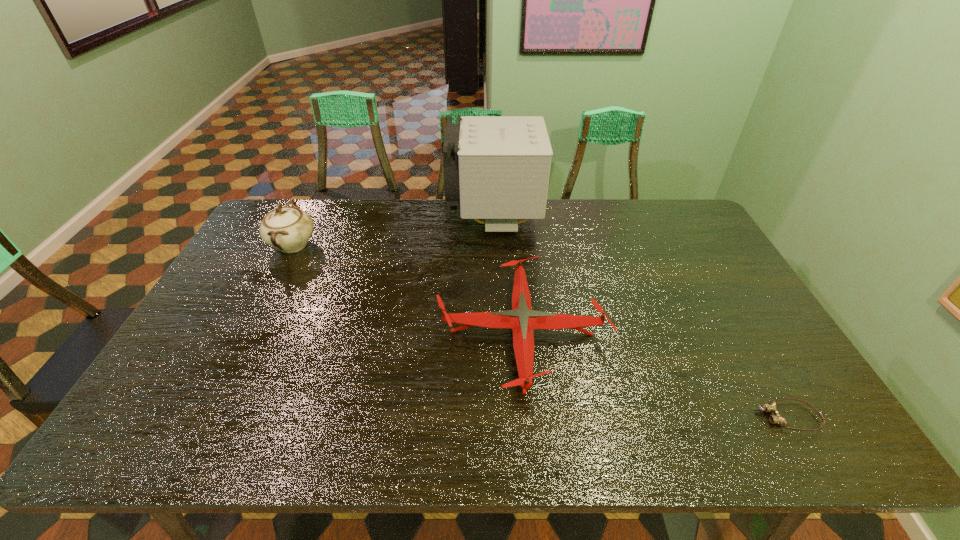
In the image, there is a desktop. Find the location of `vacant region at the near edge`. vacant region at the near edge is located at coordinates (495, 429).

In the image, there is a desktop. In order to click on vacant area at the left edge in this screenshot , I will do `click(254, 242)`.

Locate an element on the screen. This screenshot has width=960, height=540. vacant space at the right edge of the desktop is located at coordinates point(710,269).

The width and height of the screenshot is (960, 540). I want to click on vacant area at the near right corner of the desktop, so click(x=787, y=416).

Locate an element on the screen. vacant region between the drone and the fan is located at coordinates (507, 277).

You are a GUI agent. You are given a task and a screenshot of the screen. Output one action in this format:
    pyautogui.click(x=<x>, y=<y>)
    Task: Click on the vacant area that lies between the drone and the shortest object
    This screenshot has height=540, width=960.
    Given the screenshot: What is the action you would take?
    pyautogui.click(x=655, y=375)

Locate an element on the screen. vacant point located between the chinaware and the third tallest object is located at coordinates (407, 289).

You are a GUI agent. You are given a task and a screenshot of the screen. Output one action in this format:
    pyautogui.click(x=<x>, y=<y>)
    Task: Click on the empty space between the drone and the shortest object
    This screenshot has height=540, width=960.
    Given the screenshot: What is the action you would take?
    pyautogui.click(x=655, y=375)

The height and width of the screenshot is (540, 960). Identify the location of vacant area that lies between the tallest object and the second shortest object. (507, 277).

Identify the location of free space between the second tallest object and the drone. pos(407,289).